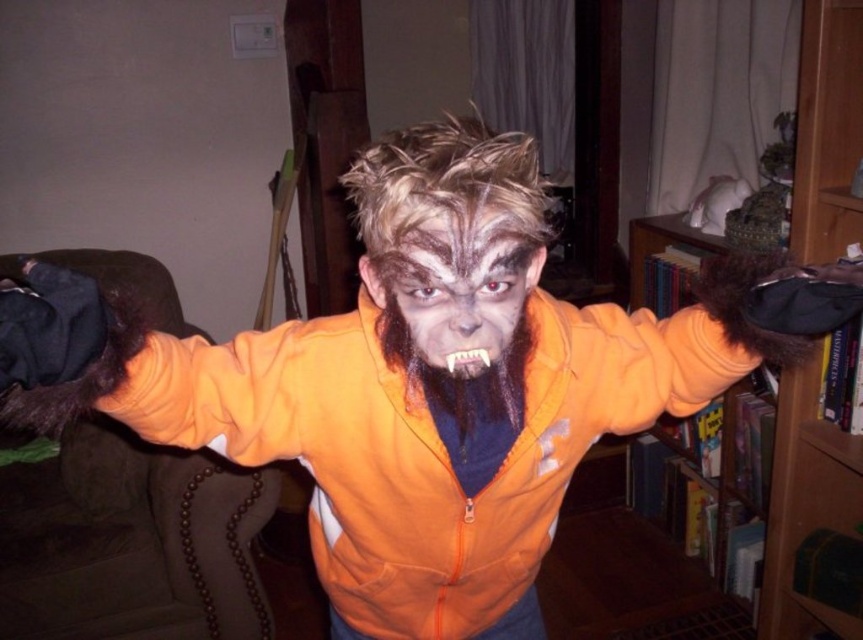
Is matte orange fur at center thinner than brown fur at center?

In fact, matte orange fur at center might be wider than brown fur at center.

Is point (492, 356) positioned before point (492, 401)?

Yes, it is in front of point (492, 401).

Identify the location of matte orange fur at center. The height and width of the screenshot is (640, 863). (460, 285).

Is point (839, 468) positioned before point (424, 308)?

No, (839, 468) is further to viewer.

Identify the location of wooden bookshelf at right. (805, 502).

Does point (845, 20) come in front of point (540, 248)?

No.

Where is `wooden bookshelf at right`? The image size is (863, 640). wooden bookshelf at right is located at coordinates (805, 502).

Consider the image. Measure the distance from wooden bookshelf at right to brown fur at center.

3.74 feet

Is point (846, 131) closer to viewer compared to point (404, 368)?

No.

Is point (836, 17) farther from camera compared to point (477, 388)?

Yes, it is.

Identify the location of wooden bookshelf at right. (805, 502).